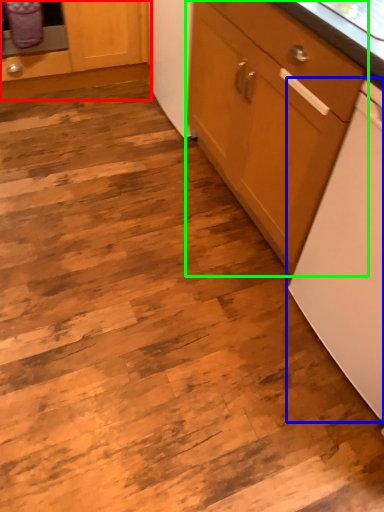
Question: Which object is positioned farthest from cabinetry (highlighted by a red box)? Select from home appliance (highlighted by a blue box) and cabinetry (highlighted by a green box).

Choices:
 (A) home appliance
 (B) cabinetry

Answer: (A)